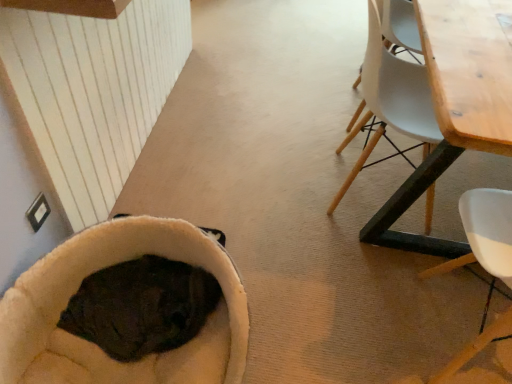
Where is `wooden chair at right`? wooden chair at right is located at coordinates (486, 233).

This screenshot has width=512, height=384. What are the coordinates of `soft beige bean bag at lower left` in the screenshot? It's located at (95, 345).

Between wooden chair at right and soft beige bean bag at lower left, which one has more height?

With more height is wooden chair at right.

In the scene shown: Is wooden chair at right not near soft beige bean bag at lower left?

wooden chair at right is near soft beige bean bag at lower left, not far away.

Which object is thinner, wooden chair at right or soft beige bean bag at lower left?

Thinner between the two is wooden chair at right.

Which is correct: wooden table at right is inside wooden chair at right, or outside of it?

wooden table at right is spatially situated outside wooden chair at right.

Would you consider wooden table at right to be distant from wooden chair at right?

No.

Consider the image. From the image's perspective, is wooden table at right beneath wooden chair at right?

No, from the image's perspective, wooden table at right is not beneath wooden chair at right.

Is soft beige bean bag at lower left inside or outside of wooden chair at right?

soft beige bean bag at lower left is not enclosed by wooden chair at right.

Is point (240, 342) closer or farther from the camera than point (450, 367)?

Point (240, 342) appears to be closer to the viewer than point (450, 367).

Considering the sizes of soft beige bean bag at lower left and wooden chair at right in the image, is soft beige bean bag at lower left taller or shorter than wooden chair at right?

soft beige bean bag at lower left is shorter than wooden chair at right.

From the image's perspective, does wooden table at right appear lower than soft beige bean bag at lower left?

No.

Is soft beige bean bag at lower left a part of wooden table at right?

Actually, soft beige bean bag at lower left is outside wooden table at right.

The image size is (512, 384). What are the coordinates of `table lying on the right of soft beige bean bag at lower left` in the screenshot? It's located at (456, 108).

Is wooden chair at right far away from wooden table at right?

No, there isn't a large distance between wooden chair at right and wooden table at right.

How far apart are wooden chair at right and wooden table at right?

44.57 centimeters.

Is wooden chair at right aimed at wooden table at right?

Yes, wooden chair at right is aimed at wooden table at right.

From a real-world perspective, does soft beige bean bag at lower left stand above wooden table at right?

No, from a real-world perspective, soft beige bean bag at lower left is not on top of wooden table at right.

Considering the positions of point (218, 331) and point (471, 37), is point (218, 331) closer or farther from the camera than point (471, 37)?

Point (218, 331) appears to be farther away from the viewer than point (471, 37).

Who is smaller, soft beige bean bag at lower left or wooden table at right?

soft beige bean bag at lower left.

Find the location of a particular element. Image resolution: width=512 pixels, height=384 pixels. chair in front of the soft beige bean bag at lower left is located at coordinates (486, 233).

This screenshot has height=384, width=512. I want to click on table located above the wooden chair at right (from a real-world perspective), so click(456, 108).

Considering their positions, is wooden chair at right positioned further to soft beige bean bag at lower left than wooden table at right?

wooden table at right lies further to soft beige bean bag at lower left than the other object.

Considering their positions, is wooden table at right positioned closer to soft beige bean bag at lower left than wooden chair at right?

Based on the image, wooden chair at right appears to be nearer to soft beige bean bag at lower left.

Looking at this image, when comparing their distances from wooden chair at right, does wooden table at right or soft beige bean bag at lower left seem closer?

Based on the image, wooden table at right appears to be nearer to wooden chair at right.

When comparing their distances from wooden chair at right, does soft beige bean bag at lower left or wooden table at right seem closer?

The object closer to wooden chair at right is wooden table at right.

When comparing their distances from wooden table at right, does wooden chair at right or soft beige bean bag at lower left seem further?

The object further to wooden table at right is soft beige bean bag at lower left.

Estimate the real-world distances between objects in this image. Which object is closer to wooden table at right, soft beige bean bag at lower left or wooden chair at right?

The object closer to wooden table at right is wooden chair at right.

You are a GUI agent. You are given a task and a screenshot of the screen. Output one action in this format:
    pyautogui.click(x=<x>, y=<y>)
    Task: Click on the chair located between soft beige bean bag at lower left and wooden table at right in the left-right direction
    The width and height of the screenshot is (512, 384).
    Given the screenshot: What is the action you would take?
    (486, 233)